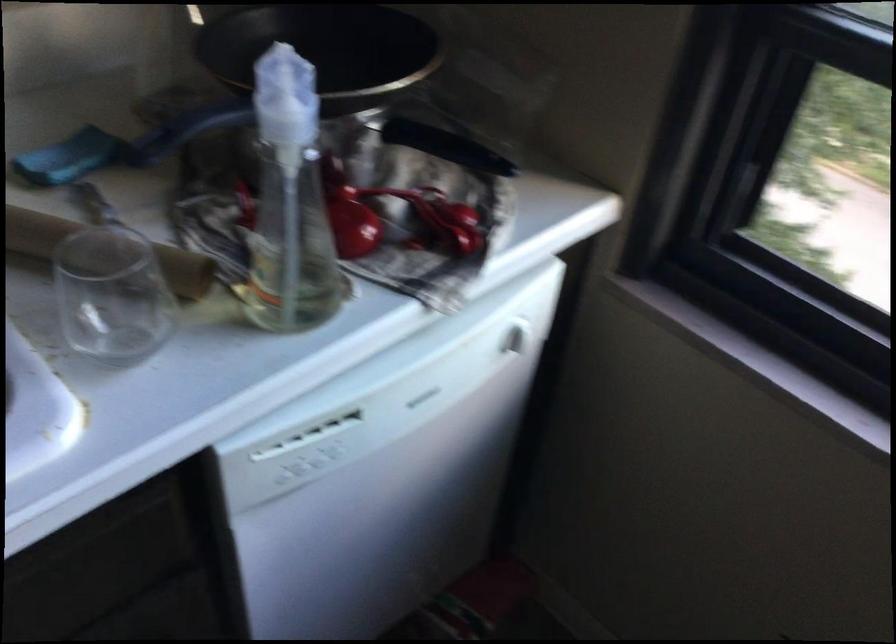
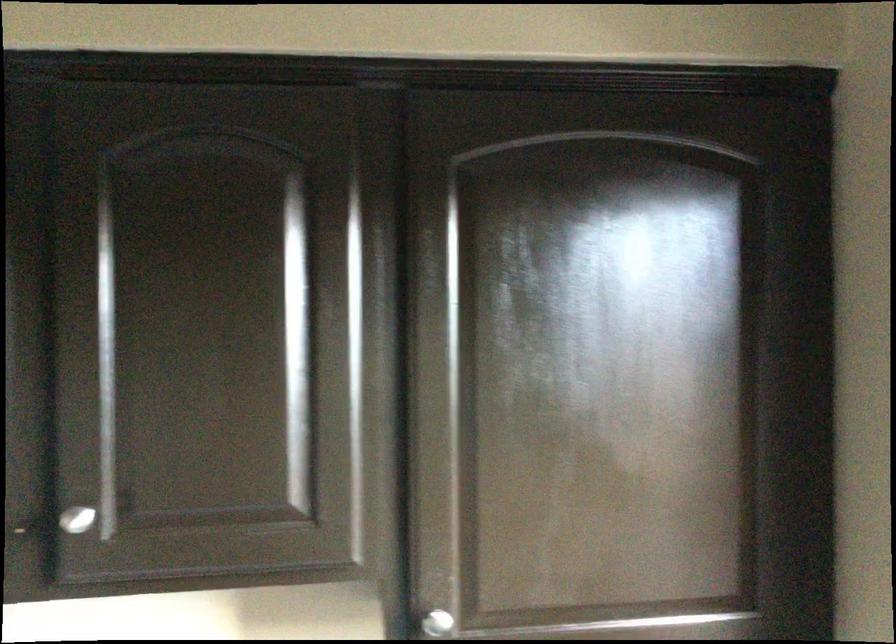
First-person continuous shooting, in which direction is the camera rotating?

The camera rotated toward left-up.